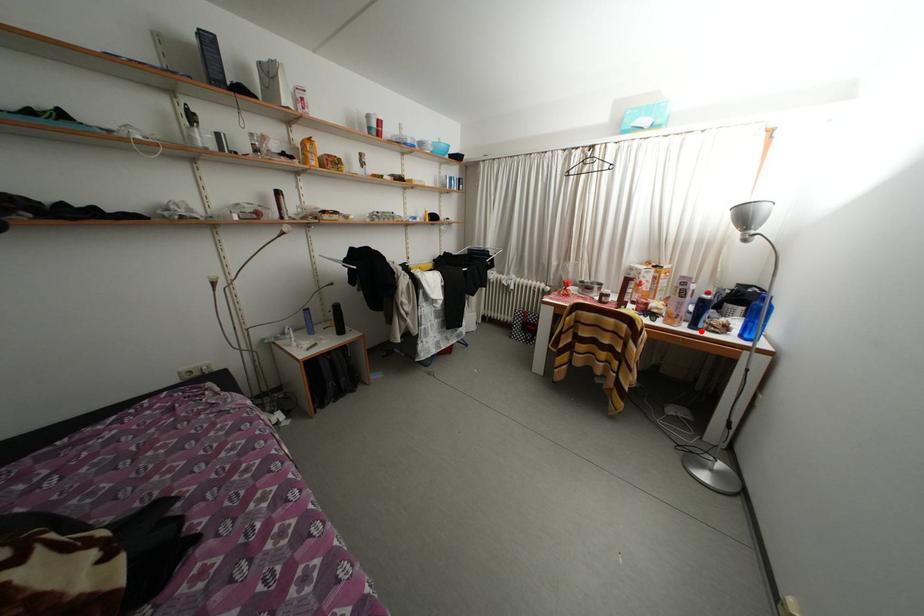
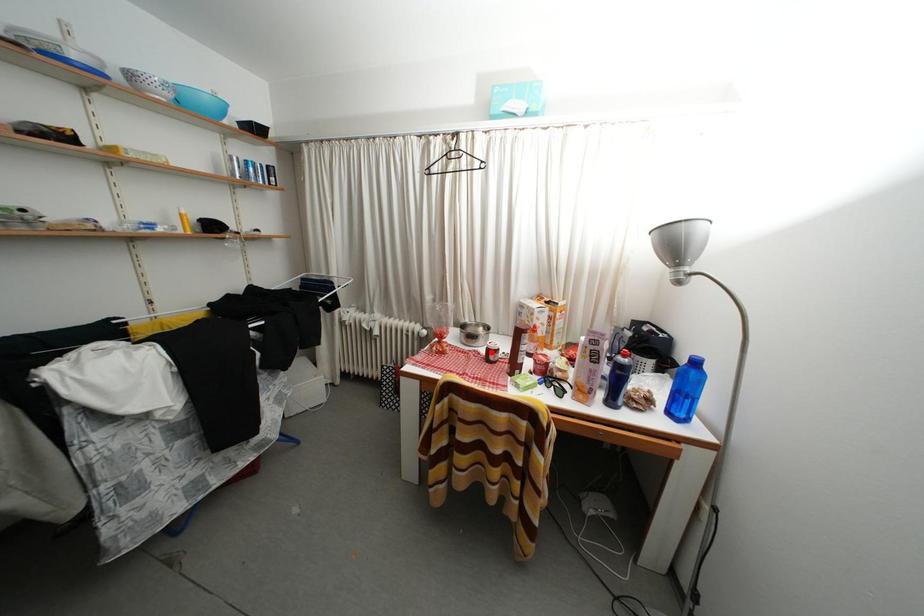
I am providing you with two images of the same scene from different viewpoints. A red point is marked on the first image and another point is marked on the second image. Is the marked point in image1 the same physical position as the marked point in image2?

No